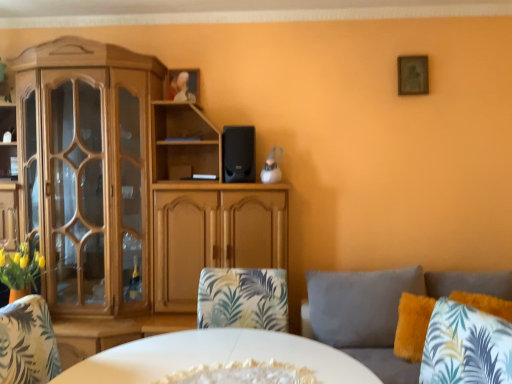
Question: Is wooden picture frame at upper right looking in the opposite direction of fluffy gray couch at right?

Choices:
 (A) yes
 (B) no

Answer: (B)

Question: Is wooden picture frame at upper right outside of fluffy gray couch at right?

Choices:
 (A) no
 (B) yes

Answer: (B)

Question: Is wooden picture frame at upper right wider than fluffy gray couch at right?

Choices:
 (A) yes
 (B) no

Answer: (B)

Question: Is wooden picture frame at upper right next to fluffy gray couch at right?

Choices:
 (A) no
 (B) yes

Answer: (A)

Question: Considering the relative sizes of wooden picture frame at upper right and fluffy gray couch at right in the image provided, is wooden picture frame at upper right shorter than fluffy gray couch at right?

Choices:
 (A) no
 (B) yes

Answer: (B)

Question: From a real-world perspective, is wooden picture frame at upper right beneath fluffy gray couch at right?

Choices:
 (A) no
 (B) yes

Answer: (A)

Question: From the image's perspective, is fluffy gray couch at right located above fluffy yellow pillow at lower right?

Choices:
 (A) yes
 (B) no

Answer: (B)

Question: Considering the relative sizes of fluffy gray couch at right and fluffy yellow pillow at lower right in the image provided, is fluffy gray couch at right shorter than fluffy yellow pillow at lower right?

Choices:
 (A) no
 (B) yes

Answer: (A)

Question: Does fluffy gray couch at right have a lesser width compared to fluffy yellow pillow at lower right?

Choices:
 (A) no
 (B) yes

Answer: (A)

Question: Is fluffy gray couch at right facing towards fluffy yellow pillow at lower right?

Choices:
 (A) yes
 (B) no

Answer: (B)

Question: From a real-world perspective, is fluffy gray couch at right on top of fluffy yellow pillow at lower right?

Choices:
 (A) yes
 (B) no

Answer: (B)

Question: Is fluffy gray couch at right smaller than fluffy yellow pillow at lower right?

Choices:
 (A) yes
 (B) no

Answer: (B)

Question: Would you say wooden cabinet at left is outside black matte speaker at center?

Choices:
 (A) no
 (B) yes

Answer: (B)